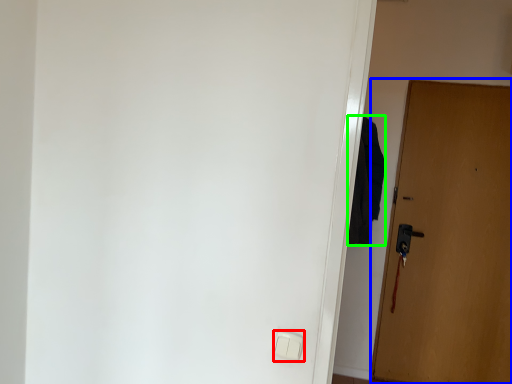
Question: Which is farther away from light switch (highlighted by a red box)? door (highlighted by a blue box) or robe (highlighted by a green box)?

Choices:
 (A) door
 (B) robe

Answer: (A)